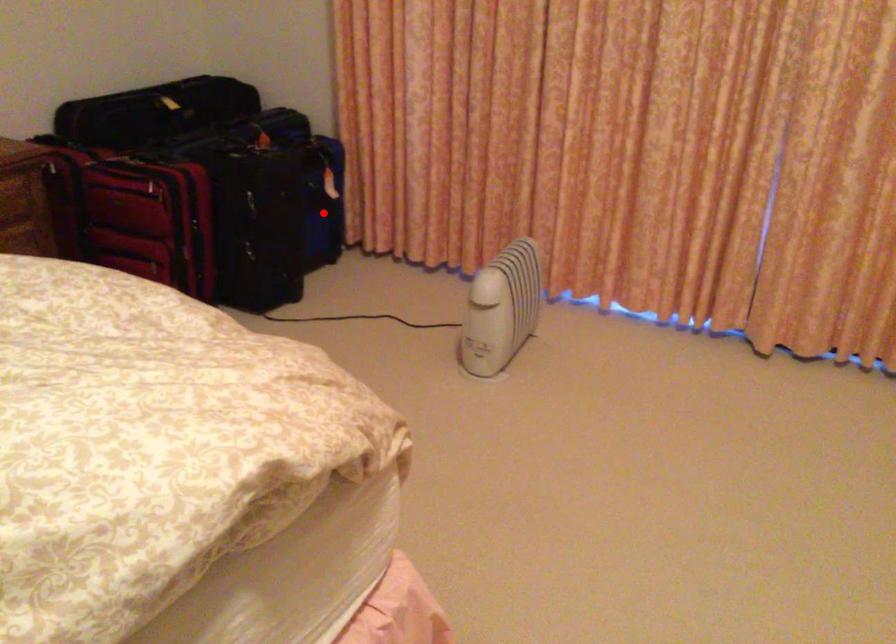
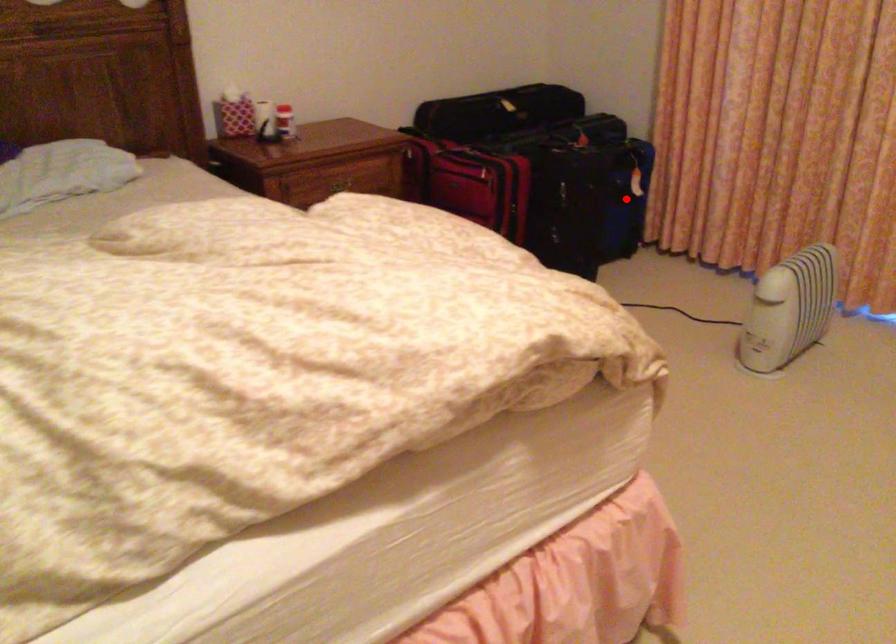
I am providing you with two images of the same scene from different viewpoints. A red point is marked on the first image and another point is marked on the second image. Is the marked point in image1 the same physical position as the marked point in image2?

Yes